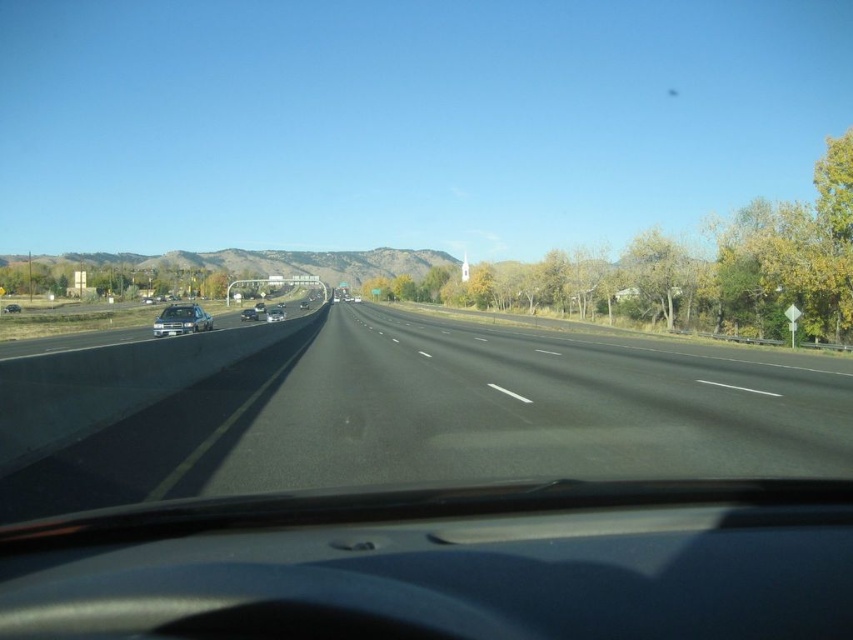
Is satin silver sedan at left taller than satin silver sedan at center?

Indeed, satin silver sedan at left has a greater height compared to satin silver sedan at center.

In the scene shown: Who is lower down, satin silver sedan at left or satin silver sedan at center?

satin silver sedan at center is lower down.

Between point (164, 317) and point (277, 316), which one is positioned behind?

Positioned behind is point (277, 316).

The width and height of the screenshot is (853, 640). Identify the location of satin silver sedan at left. coord(181,321).

Does satin silver sedan at center have a smaller size compared to satin black sedan at center?

No.

Does point (281, 312) lie behind point (242, 316)?

No, (281, 312) is in front of (242, 316).

Is point (273, 314) less distant than point (251, 308)?

Yes, point (273, 314) is closer to viewer.

I want to click on satin silver sedan at center, so click(274, 314).

Who is more distant from viewer, (424, 420) or (283, 317)?

The point (283, 317) is more distant.

At what (x,y) coordinates should I click in order to perform the action: click on black asphalt highway at center. Please return your answer as a coordinate pair (x, y). Looking at the image, I should click on (456, 416).

The width and height of the screenshot is (853, 640). What are the coordinates of `black asphalt highway at center` in the screenshot? It's located at (456, 416).